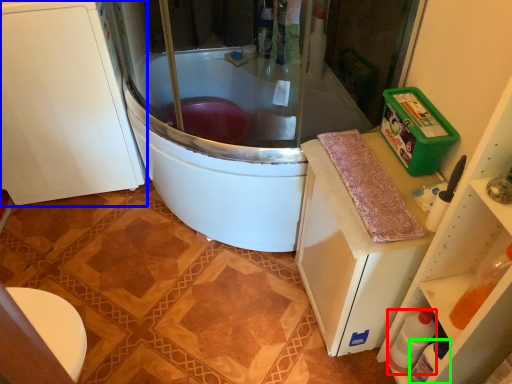
Question: Which is nearer to the bottle (highlighted by a red box)? cabinetry (highlighted by a blue box) or bottle (highlighted by a green box).

Choices:
 (A) cabinetry
 (B) bottle

Answer: (B)